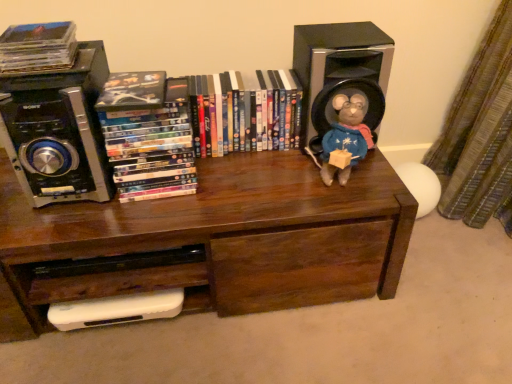
Locate an element on the screen. This screenshot has width=512, height=384. free location in front of matte plastic dvds at left, positioned as the 2th book in right-to-left order is located at coordinates (146, 217).